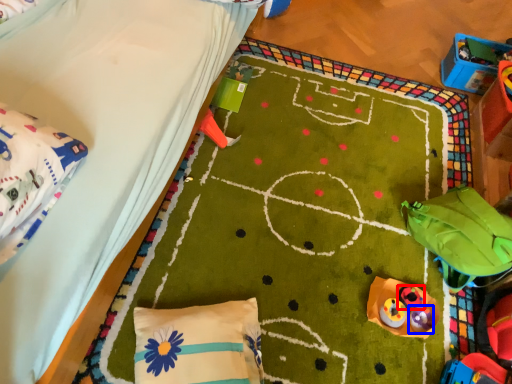
Question: Which of the following is the farthest to the observer, toy (highlighted by a red box) or toy (highlighted by a blue box)?

Choices:
 (A) toy
 (B) toy

Answer: (A)